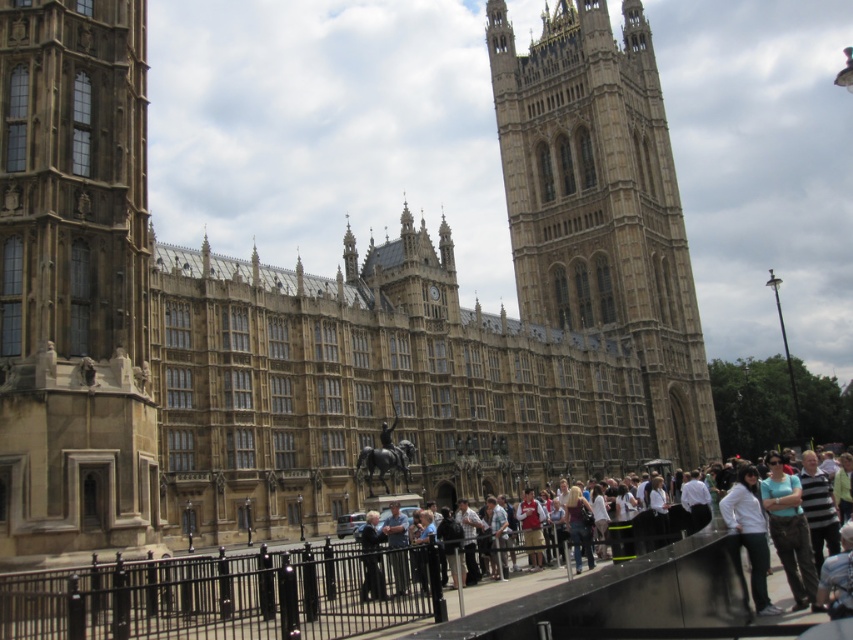
In the scene shown: Who is more forward, (148,301) or (515,113)?

Point (148,301)

Can you confirm if brown stone tower at left is positioned below golden stone tower at center?

Indeed, brown stone tower at left is positioned under golden stone tower at center.

Describe the element at coordinates (74, 284) in the screenshot. This screenshot has width=853, height=640. I see `brown stone tower at left` at that location.

This screenshot has width=853, height=640. Find the location of `brown stone tower at left`. brown stone tower at left is located at coordinates (74, 284).

Between golden stone tower at center and denim pants at lower right, which one has less height?

denim pants at lower right

Can you confirm if golden stone tower at center is smaller than denim pants at lower right?

No, golden stone tower at center is not smaller than denim pants at lower right.

Where is `golden stone tower at center`? golden stone tower at center is located at coordinates (602, 205).

Which of these two, black metal fence at lower center or light brown fabric crowd at center, stands shorter?

black metal fence at lower center

Which of these two, black metal fence at lower center or light brown fabric crowd at center, stands taller?

light brown fabric crowd at center

The image size is (853, 640). I want to click on black metal fence at lower center, so click(227, 595).

The height and width of the screenshot is (640, 853). What are the coordinates of `black metal fence at lower center` in the screenshot? It's located at (227, 595).